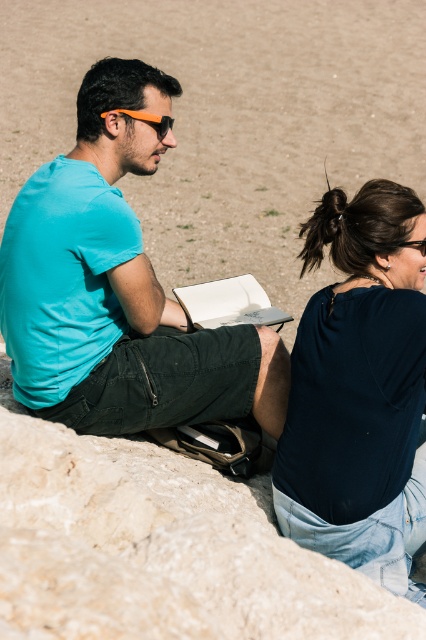
Question: Can you confirm if matte teal shirt at left is positioned to the left of dark blue fabric shirt at upper right?

Choices:
 (A) no
 (B) yes

Answer: (B)

Question: Can you confirm if matte teal shirt at left is bigger than dark blue fabric shirt at upper right?

Choices:
 (A) no
 (B) yes

Answer: (B)

Question: Which point is closer to the camera taking this photo?

Choices:
 (A) (291, 461)
 (B) (425, 252)

Answer: (A)

Question: Which object is closer to the camera taking this photo?

Choices:
 (A) dark blue fabric shirt at upper right
 (B) orange plastic goggles at left
 (C) matte teal shirt at left

Answer: (A)

Question: Is matte teal shirt at left below orange matte goggles at upper center?

Choices:
 (A) no
 (B) yes

Answer: (A)

Question: Based on their relative distances, which object is nearer to the orange matte goggles at upper center?

Choices:
 (A) orange plastic goggles at left
 (B) dark blue fabric shirt at upper right

Answer: (B)